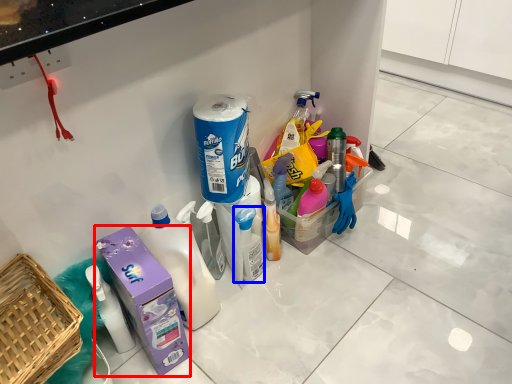
Question: Which of the following is the farthest to the observer, carton (highlighted by a red box) or cleaning product (highlighted by a blue box)?

Choices:
 (A) carton
 (B) cleaning product

Answer: (B)